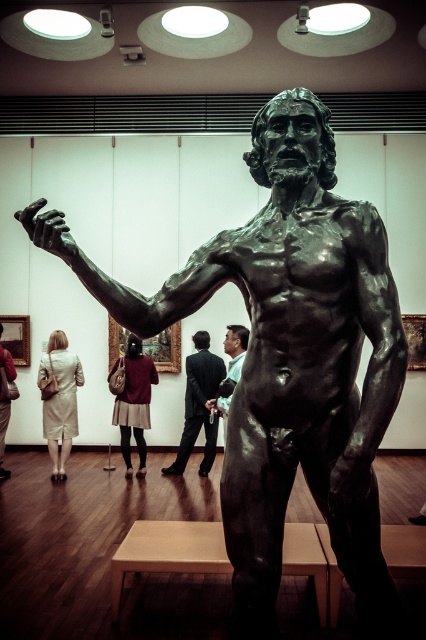
Question: Among these points, which one is nearest to the camera?

Choices:
 (A) (126, 465)
 (B) (238, 362)
 (C) (198, 381)
 (D) (74, 433)

Answer: (B)

Question: Which point appears closest to the camera in this image?

Choices:
 (A) (201, 403)
 (B) (66, 401)
 (C) (141, 371)
 (D) (233, 374)

Answer: (D)

Question: Is light beige coat at lower left in front of matte brown skirt at center?

Choices:
 (A) yes
 (B) no

Answer: (A)

Question: Does dark suit at center appear under matte brown skirt at center?

Choices:
 (A) yes
 (B) no

Answer: (B)

Question: Which of these objects is positioned closest to the matte brown skirt at center?

Choices:
 (A) bronze statue at center
 (B) light beige coat at lower left

Answer: (B)

Question: Can you confirm if light beige coat at lower left is positioned to the left of matte brown skirt at center?

Choices:
 (A) yes
 (B) no

Answer: (A)